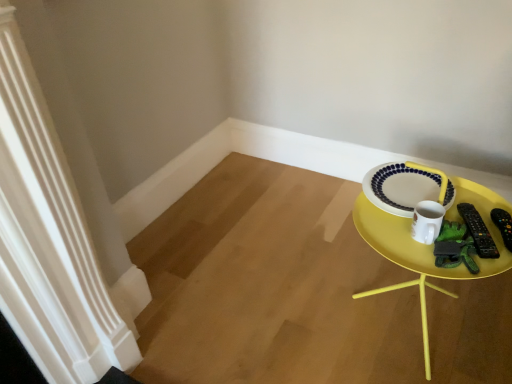
Where is `free space above white glossy plate at upper right (from a real-world perspective)`? free space above white glossy plate at upper right (from a real-world perspective) is located at coordinates (416, 188).